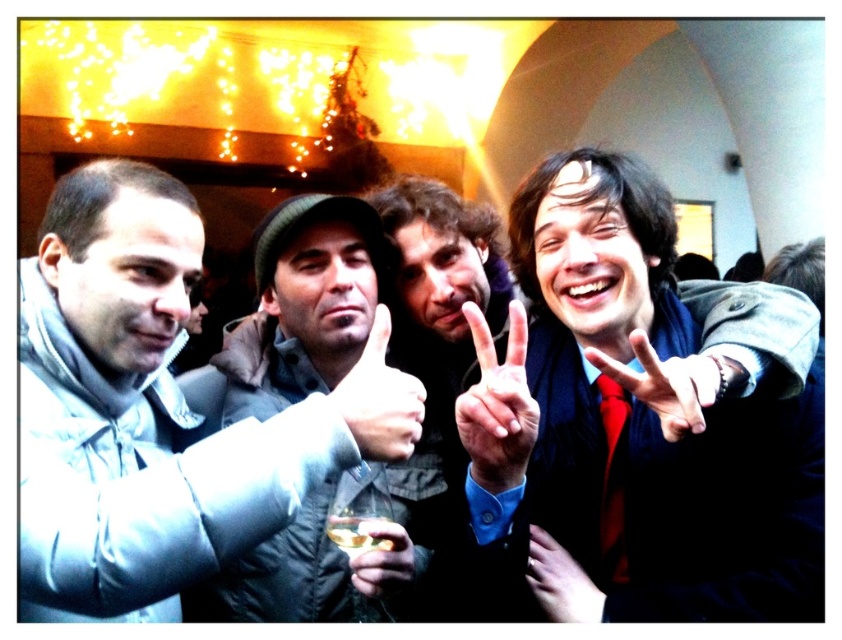
Is matte black hand at center above smooth skin hand at center?

Correct, matte black hand at center is located above smooth skin hand at center.

Between point (338, 403) and point (549, 570), which one is positioned in front?

Point (338, 403)

Where is `matte black hand at center`? matte black hand at center is located at coordinates (380, 400).

Which is below, matte black hand at center right or smooth skin hand at center?

smooth skin hand at center is below.

Who is positioned more to the left, matte black hand at center right or smooth skin hand at center?

smooth skin hand at center is more to the left.

Is point (674, 376) positioned behind point (546, 552)?

That is False.

At what (x,y) coordinates should I click in order to perform the action: click on matte black hand at center right. Please return your answer as a coordinate pair (x, y). Image resolution: width=842 pixels, height=640 pixels. Looking at the image, I should click on (663, 385).

Does gray matte jacket at upper left have a greater width compared to smooth skin hand at center?

Indeed, gray matte jacket at upper left has a greater width compared to smooth skin hand at center.

Is gray matte jacket at upper left to the left of smooth skin hand at center from the viewer's perspective?

Correct, you'll find gray matte jacket at upper left to the left of smooth skin hand at center.

The width and height of the screenshot is (842, 640). In order to click on gray matte jacket at upper left in this screenshot , I will do `click(155, 412)`.